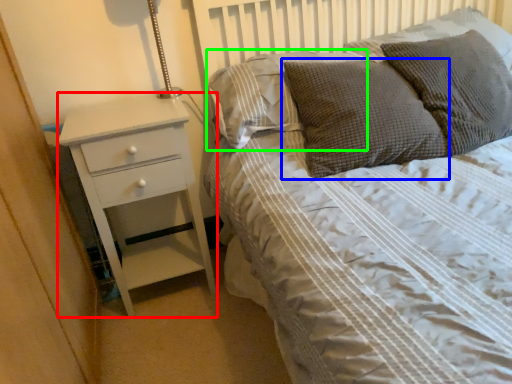
Question: Which is nearer to the chest of drawers (highlighted by a red box)? pillow (highlighted by a blue box) or pillow (highlighted by a green box).

Choices:
 (A) pillow
 (B) pillow

Answer: (B)